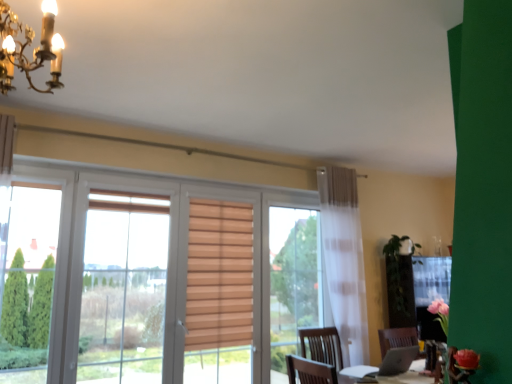
Question: In terms of height, does gold metallic chandelier at upper left look taller or shorter compared to green matte plant at right?

Choices:
 (A) tall
 (B) short

Answer: (B)

Question: From a real-world perspective, is gold metallic chandelier at upper left above or below green matte plant at right?

Choices:
 (A) above
 (B) below

Answer: (A)

Question: Is point (4, 26) closer or farther from the camera than point (413, 289)?

Choices:
 (A) farther
 (B) closer

Answer: (B)

Question: In terms of height, does green matte plant at right look taller or shorter compared to gold metallic chandelier at upper left?

Choices:
 (A) short
 (B) tall

Answer: (B)

Question: Is point (398, 241) closer or farther from the camera than point (59, 72)?

Choices:
 (A) farther
 (B) closer

Answer: (A)

Question: Looking at their shapes, would you say green matte plant at right is wider or thinner than gold metallic chandelier at upper left?

Choices:
 (A) thin
 (B) wide

Answer: (B)

Question: From the image's perspective, is green matte plant at right positioned above or below gold metallic chandelier at upper left?

Choices:
 (A) above
 (B) below

Answer: (B)